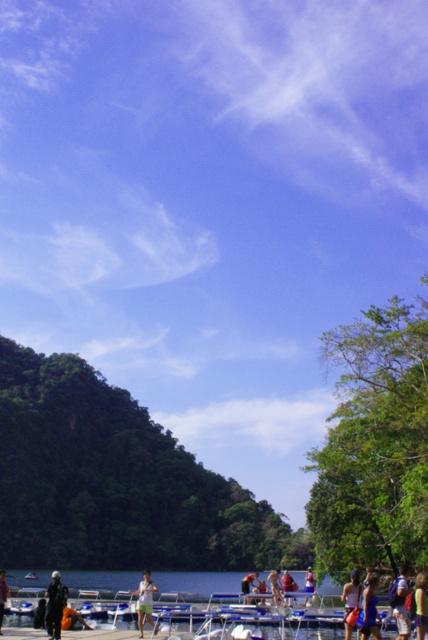
Looking at this image, you are organizing a clothing donation drive and need to know if the green fabric shirt at center can fit into a box designed for shirts narrower than the light brown fabric shirt at center. Can it fit?

The green fabric shirt at center has a smaller width than the light brown fabric shirt at center, so it can fit into the box designed for narrower shirts.

You are a photographer standing at the water edge in the image. You want to place your camera on the ground near the dark blue fabric bag at lower right. What is the exact 2D coordinate where you should place your camera?

The dark blue fabric bag at lower right is located at the 2D coordinate point of (401,602), so you should place your camera near that coordinate.

You are a photographer trying to capture a group photo of the two people wearing the green fabric shirt at center and light brown fabric shirt at center. Since you want both subjects to be clearly visible, which person should you focus on more to ensure their entire body fits in the frame?

You should focus more on the light brown fabric shirt at center because it occupies more space than the green fabric shirt at center, ensuring both are visible.